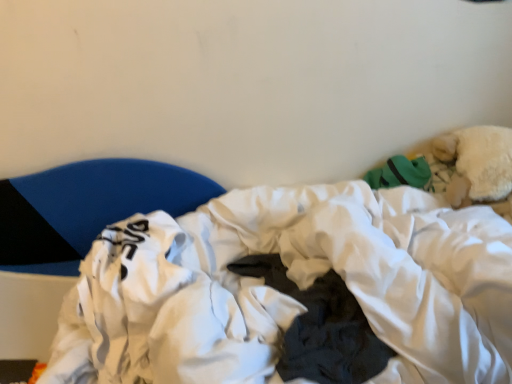
Question: Does point (57, 195) appear closer or farther from the camera than point (222, 246)?

Choices:
 (A) closer
 (B) farther

Answer: (B)

Question: Considering the positions of blue fabric pillow at left and white soft fabric at center in the image, is blue fabric pillow at left wider or thinner than white soft fabric at center?

Choices:
 (A) thin
 (B) wide

Answer: (A)

Question: Is blue fabric pillow at left inside the boundaries of white soft fabric at center, or outside?

Choices:
 (A) inside
 (B) outside

Answer: (B)

Question: Is white soft fabric at center to the left or to the right of blue fabric pillow at left in the image?

Choices:
 (A) right
 (B) left

Answer: (A)

Question: Do you think white soft fabric at center is within blue fabric pillow at left, or outside of it?

Choices:
 (A) outside
 (B) inside

Answer: (A)

Question: Is point (446, 309) closer or farther from the camera than point (59, 230)?

Choices:
 (A) closer
 (B) farther

Answer: (A)

Question: In terms of height, does white soft fabric at center look taller or shorter compared to blue fabric pillow at left?

Choices:
 (A) tall
 (B) short

Answer: (A)